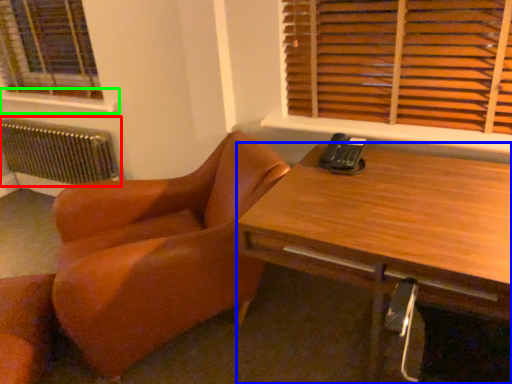
Question: Based on their relative distances, which object is farther from radiator (highlighted by a red box)? Choose from desk (highlighted by a blue box) and window sill (highlighted by a green box).

Choices:
 (A) desk
 (B) window sill

Answer: (A)